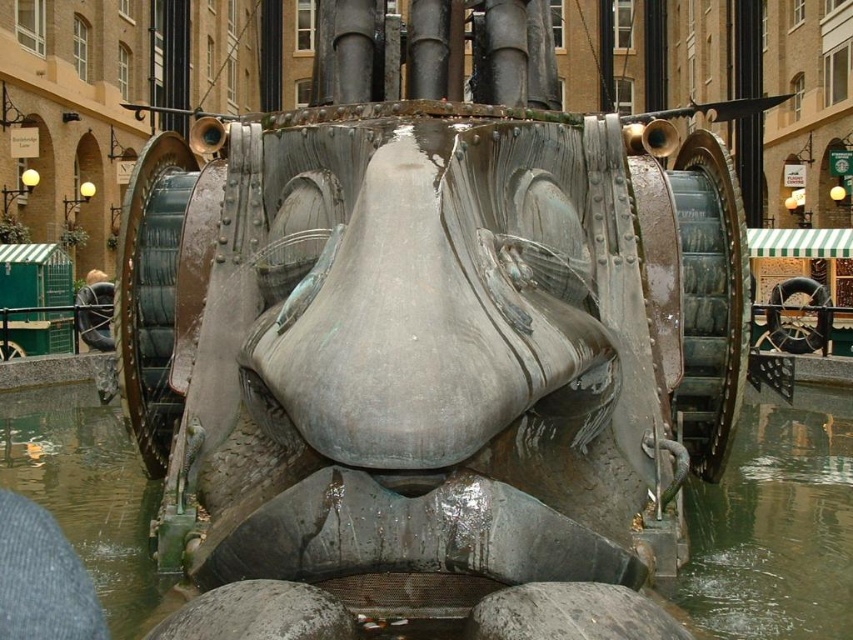
Is metallic gray water at center positioned in front of clear water at lower center?

Yes, it is.

In the scene shown: Can you confirm if metallic gray water at center is positioned to the left of clear water at lower center?

Indeed, metallic gray water at center is positioned on the left side of clear water at lower center.

Who is more distant from viewer, (x=780, y=547) or (x=750, y=580)?

Positioned behind is point (x=780, y=547).

Find the location of a particular element. The image size is (853, 640). metallic gray water at center is located at coordinates pyautogui.click(x=775, y=525).